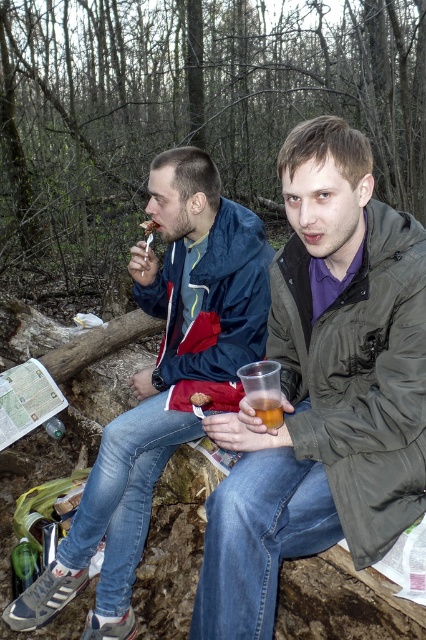
You are planning to pick up the translucent plastic cup at lower center and the matte plastic spoon at upper left. Based on their positions, which one would you reach first if you start from the center of the image?

The matte plastic spoon at upper left is to the left of the translucent plastic cup at lower center, so you would reach the matte plastic spoon at upper left first when starting from the center of the image.

You are a hiker who just arrived at this forest area. You see the matte blue jacket at left and the matte brown bread at center. Which item is closer to the ground?

The matte blue jacket at left is located below matte brown bread at center, so the matte blue jacket at left is closer to the ground.

From the picture: You are standing at the origin of the coordinate system. You see a point at coordinates (163, 381). What object is located at that point?

The point at coordinates (163, 381) marks the matte blue jacket at left.